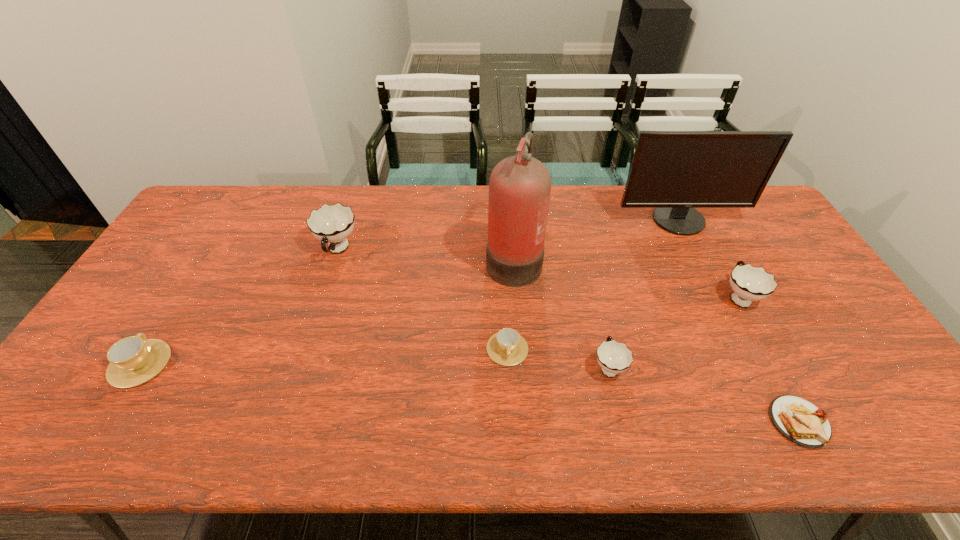
The width and height of the screenshot is (960, 540). In order to click on the leftmost cup in this screenshot , I will do click(x=133, y=360).

Locate an element on the screen. This screenshot has width=960, height=540. the right brown cup is located at coordinates (507, 347).

In order to click on the third cup from left to right in this screenshot , I will do `click(507, 347)`.

At what (x,y) coordinates should I click in order to perform the action: click on sandwich. Please return your answer as a coordinate pair (x, y). This screenshot has height=540, width=960. Looking at the image, I should click on (800, 421).

This screenshot has width=960, height=540. I want to click on the shortest object, so click(x=800, y=421).

Locate an element on the screen. vacant space positioned at the nozzle of the tallest object is located at coordinates (416, 259).

At what (x,y) coordinates should I click in order to perform the action: click on blank area located at the nozzle of the tallest object. Please return your answer as a coordinate pair (x, y). The image size is (960, 540). Looking at the image, I should click on (373, 259).

In order to click on vacant position located at the nozzle of the tallest object in this screenshot , I will do `click(460, 259)`.

This screenshot has height=540, width=960. In order to click on vacant space situated on the screen side of the monitor in this screenshot , I will do `click(727, 318)`.

Where is `vacant space positioned on the side of the leftmost white cup with the handle`? vacant space positioned on the side of the leftmost white cup with the handle is located at coordinates (308, 340).